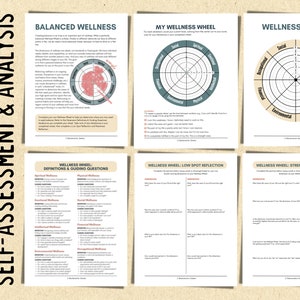
Find the location of a particular element. This screenshot has height=300, width=300. green trim is located at coordinates (181, 45), (165, 93), (205, 96).